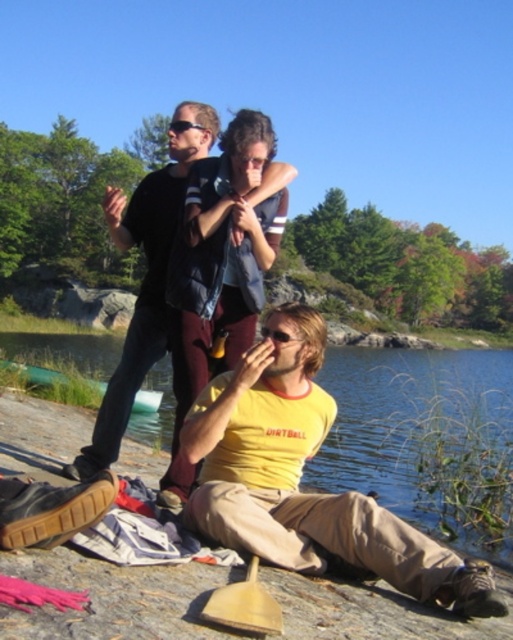
Question: Can you confirm if yellow cotton shirt at center is thinner than dark blue jeans at upper center?

Choices:
 (A) yes
 (B) no

Answer: (A)

Question: Which object appears farthest from the camera in this image?

Choices:
 (A) yellow cotton shirt at center
 (B) dark blue jeans at upper center

Answer: (B)

Question: Does yellow cotton shirt at center have a smaller size compared to dark blue jeans at upper center?

Choices:
 (A) no
 (B) yes

Answer: (B)

Question: Can you confirm if yellow cotton shirt at center is bigger than dark blue jeans at upper center?

Choices:
 (A) no
 (B) yes

Answer: (A)